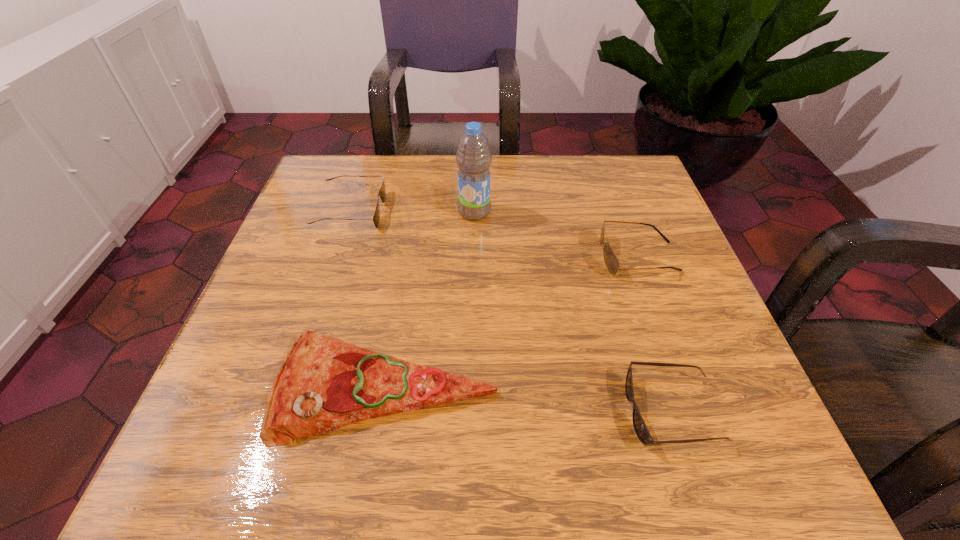
Image resolution: width=960 pixels, height=540 pixels. Find the location of `free space between the tallest sunglasses and the water bottle`. free space between the tallest sunglasses and the water bottle is located at coordinates (556, 234).

At what (x,y) coordinates should I click in order to perform the action: click on vacant area that lies between the water bottle and the fourth shortest object. Please return your answer as a coordinate pair (x, y). The width and height of the screenshot is (960, 540). Looking at the image, I should click on (556, 234).

Locate an element on the screen. The width and height of the screenshot is (960, 540). free space between the pizza and the third farthest object is located at coordinates (512, 322).

Locate which object is the fourth closest to the nearest sunglasses. Please provide its 2D coordinates. Your answer should be formatted as a tuple, i.e. [(x, y)], where the tuple contains the x and y coordinates of a point satisfying the conditions above.

[(382, 192)]

Locate an element on the screen. The width and height of the screenshot is (960, 540). object that stands as the third closest to the second tallest sunglasses is located at coordinates (612, 264).

Where is `sunglasses that is the nearest to the tallest sunglasses`? This screenshot has width=960, height=540. sunglasses that is the nearest to the tallest sunglasses is located at coordinates (640, 427).

At what (x,y) coordinates should I click in order to perform the action: click on sunglasses that is the nearest to the tallest object. Please return your answer as a coordinate pair (x, y). The width and height of the screenshot is (960, 540). Looking at the image, I should click on (382, 192).

Where is `free space that satisfies the following two spatial constraints: 1. on the front-facing side of the water bottle; 2. on the left side of the second tallest sunglasses`? This screenshot has height=540, width=960. free space that satisfies the following two spatial constraints: 1. on the front-facing side of the water bottle; 2. on the left side of the second tallest sunglasses is located at coordinates (350, 212).

The width and height of the screenshot is (960, 540). In order to click on vacant space that satisfies the following two spatial constraints: 1. on the back side of the tallest object; 2. on the right side of the pizza in this screenshot , I will do `click(416, 212)`.

The width and height of the screenshot is (960, 540). I want to click on free region that satisfies the following two spatial constraints: 1. on the front-facing side of the pizza; 2. on the left side of the second shortest sunglasses, so click(293, 388).